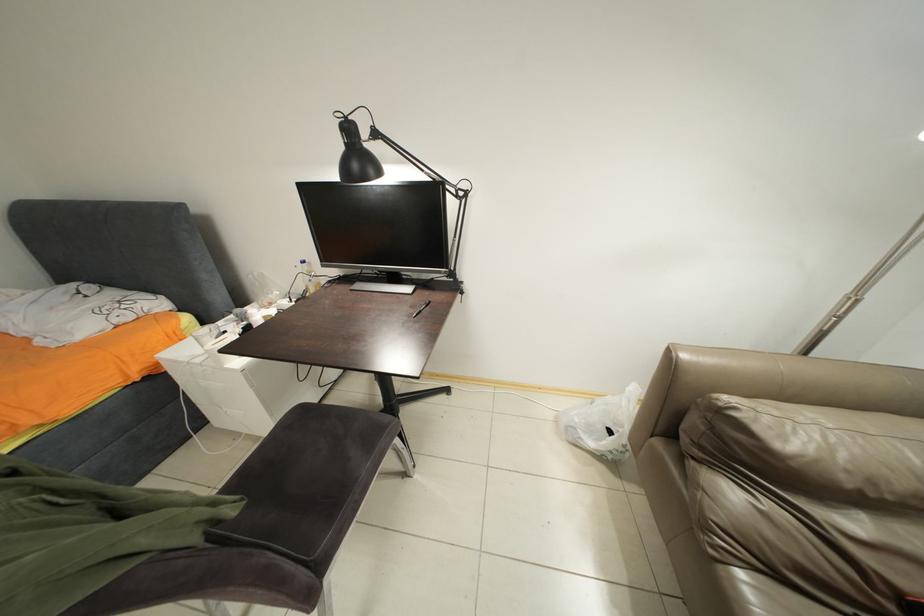
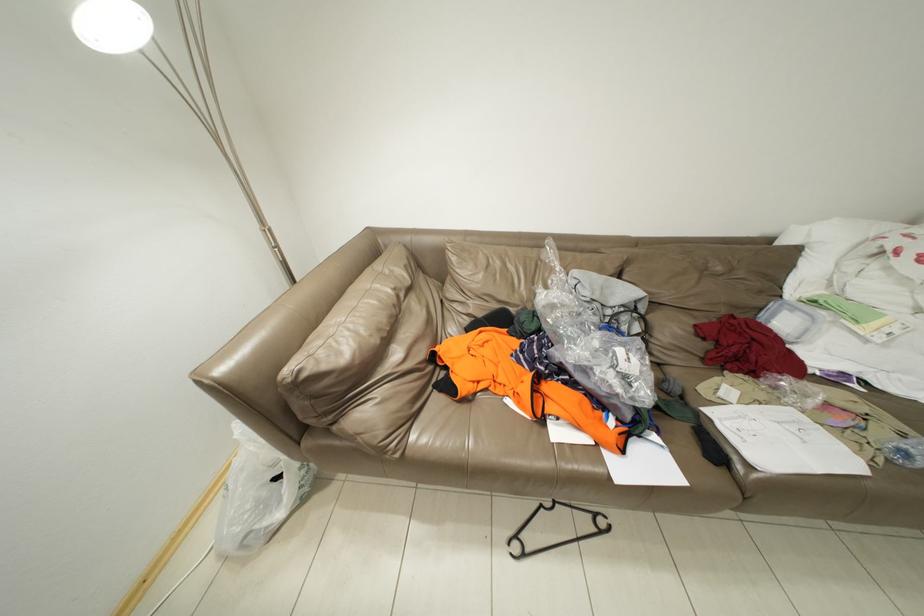
How did the camera likely rotate?

The camera's rotation is toward right-down.